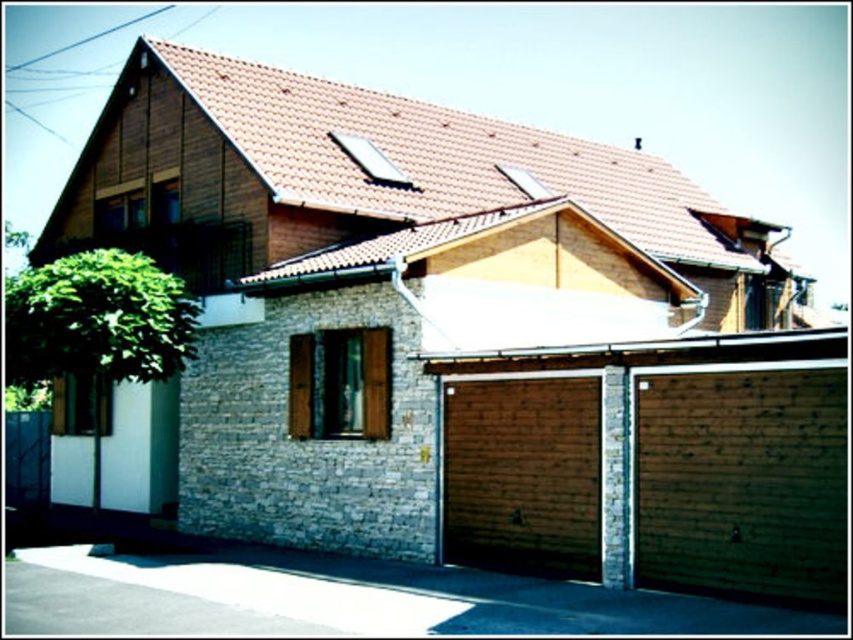
Is wooden garage door at lower right taller than wooden at lower center?

In fact, wooden garage door at lower right may be shorter than wooden at lower center.

Does wooden garage door at lower right appear under wooden at lower center?

Indeed, wooden garage door at lower right is positioned under wooden at lower center.

Who is more forward, (612,531) or (567,465)?

Point (612,531)

I want to click on wooden garage door at lower right, so click(654, 464).